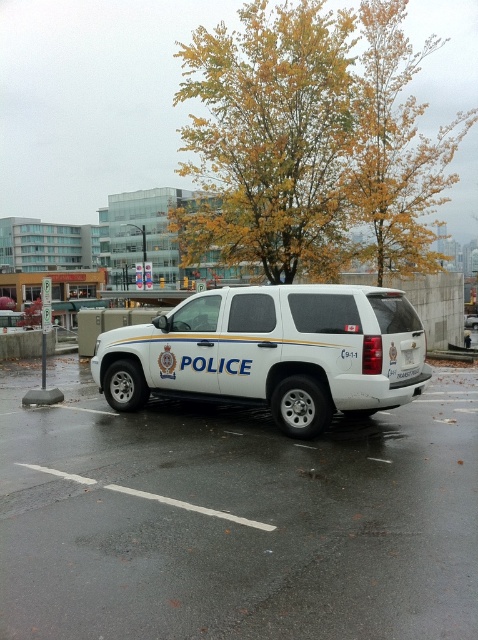
You are a pedestrian standing in front of the white glossy police car at center and the white plastic license plate at rear. Which object is closer to the left side of the frame?

The white glossy police car at center is positioned on the left side of white plastic license plate at rear, so it is closer to the left side of the frame.

You are a pedestrian standing in front of the white glossy police car at center. You want to walk to the yellow leaves at upper center. Which direction should you move in?

The white glossy police car at center is to the left of yellow leaves at upper center, so you should move to the right to reach the yellow leaves at upper center.

You are a pedestrian standing at the edge of the parking lot. You see the white matte police suv at center and the yellow leaves at upper center. Which object is closer to you?

The white matte police suv at center is positioned under yellow leaves at upper center, meaning the suv is closer to you than the leaves.